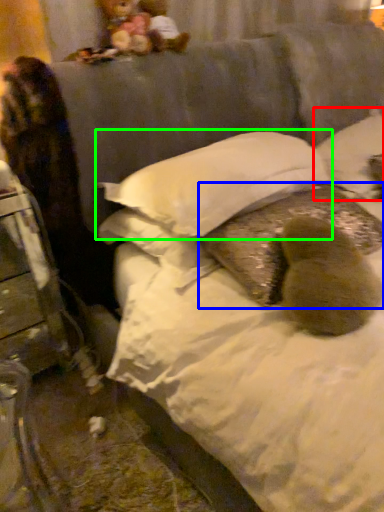
Question: Considering the real-world distances, which object is closest to pillow (highlighted by a red box)? pillow (highlighted by a blue box) or pillow (highlighted by a green box).

Choices:
 (A) pillow
 (B) pillow

Answer: (A)